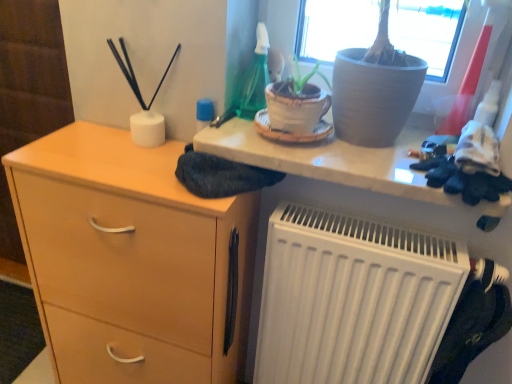
Question: Is matte gray pot at upper center not within white matte radiator at lower right?

Choices:
 (A) yes
 (B) no

Answer: (A)

Question: Is matte gray pot at upper center positioned far away from white matte radiator at lower right?

Choices:
 (A) no
 (B) yes

Answer: (A)

Question: From a real-world perspective, is matte gray pot at upper center located beneath white matte radiator at lower right?

Choices:
 (A) no
 (B) yes

Answer: (A)

Question: Considering the relative sizes of matte gray pot at upper center and white matte radiator at lower right in the image provided, is matte gray pot at upper center taller than white matte radiator at lower right?

Choices:
 (A) no
 (B) yes

Answer: (A)

Question: Is matte gray pot at upper center at the left side of white matte radiator at lower right?

Choices:
 (A) yes
 (B) no

Answer: (A)

Question: Looking at their shapes, would you say white matte radiator at lower right is wider or thinner than matte gray pot at upper center?

Choices:
 (A) thin
 (B) wide

Answer: (A)

Question: In terms of size, does white matte radiator at lower right appear bigger or smaller than matte gray pot at upper center?

Choices:
 (A) big
 (B) small

Answer: (A)

Question: Choose the correct answer: Is white matte radiator at lower right inside matte gray pot at upper center or outside it?

Choices:
 (A) inside
 (B) outside

Answer: (B)

Question: From the image's perspective, is white matte radiator at lower right above or below matte gray pot at upper center?

Choices:
 (A) above
 (B) below

Answer: (B)

Question: In terms of size, does light wood/finish chest of drawers at left appear bigger or smaller than white matte radiator at lower right?

Choices:
 (A) big
 (B) small

Answer: (A)

Question: From a real-world perspective, is light wood/finish chest of drawers at left above or below white matte radiator at lower right?

Choices:
 (A) below
 (B) above

Answer: (A)

Question: From the image's perspective, is light wood/finish chest of drawers at left located above or below white matte radiator at lower right?

Choices:
 (A) above
 (B) below

Answer: (A)

Question: Is light wood/finish chest of drawers at left taller or shorter than white matte radiator at lower right?

Choices:
 (A) short
 (B) tall

Answer: (B)

Question: Is matte gray pot at upper center in front of or behind white matte radiator at lower right in the image?

Choices:
 (A) behind
 (B) front

Answer: (B)

Question: From the image's perspective, is matte gray pot at upper center located above or below white matte radiator at lower right?

Choices:
 (A) above
 (B) below

Answer: (A)